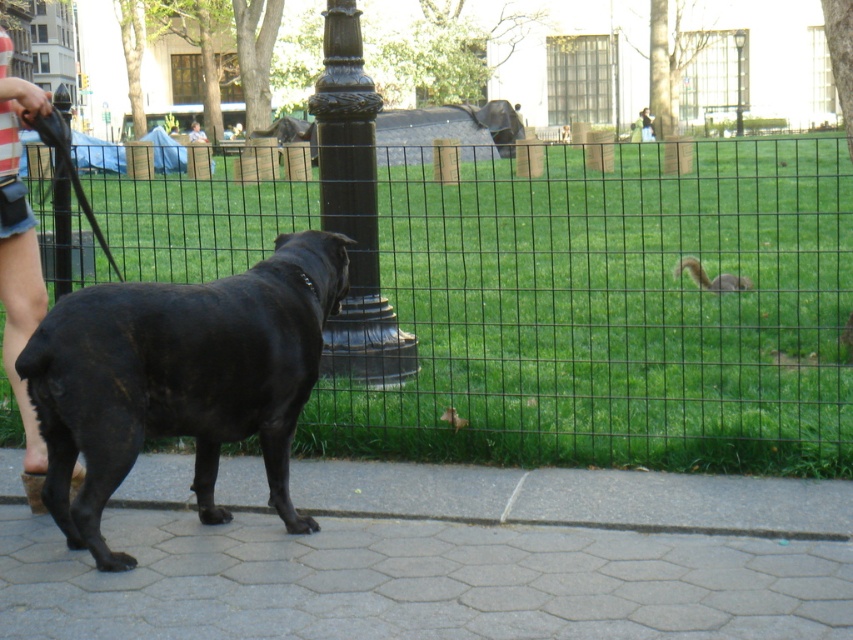
Question: Among these points, which one is nearest to the camera?

Choices:
 (A) (363, 268)
 (B) (735, 42)
 (C) (317, 358)

Answer: (C)

Question: Can you confirm if gray hexagonal paving stone at lower center is positioned above gray furry squirrel at center right?

Choices:
 (A) yes
 (B) no

Answer: (B)

Question: Can you confirm if black wire mesh fence at center is wider than metallic glass lamp post at upper center?

Choices:
 (A) no
 (B) yes

Answer: (B)

Question: Can you confirm if black polished metal pole at center is positioned above metallic glass lamp post at upper center?

Choices:
 (A) no
 (B) yes

Answer: (A)

Question: Which of the following is the farthest from the observer?

Choices:
 (A) black wire mesh fence at center
 (B) light brown leather jacket at upper center

Answer: (B)

Question: Which point is farther to the camera?

Choices:
 (A) (196, 125)
 (B) (735, 48)
 (C) (817, 250)

Answer: (B)